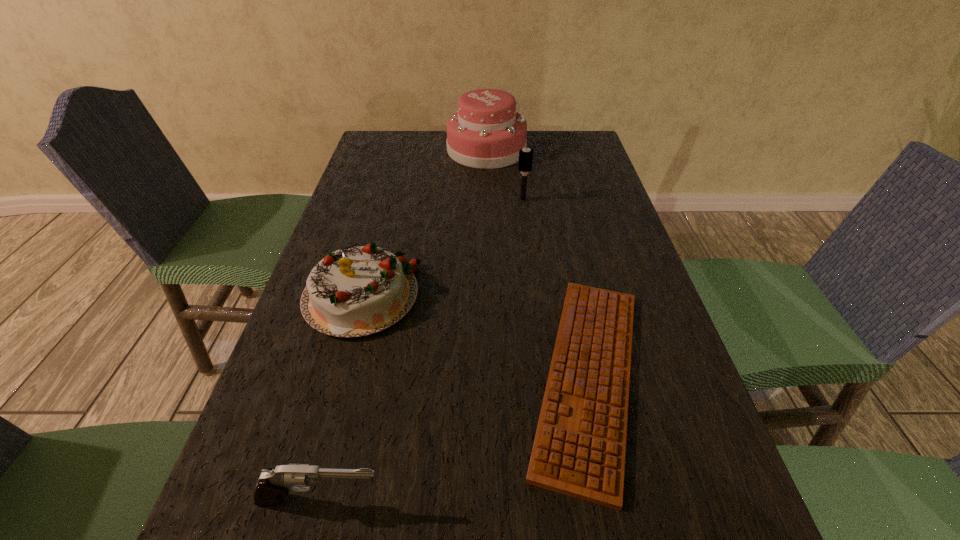
I want to click on the right cake, so click(486, 132).

Identify the location of the farther cake. (486, 132).

Where is `the second farthest object`? The image size is (960, 540). the second farthest object is located at coordinates (525, 157).

Identify the location of the left cake. The width and height of the screenshot is (960, 540). (356, 291).

I want to click on the shorter cake, so click(356, 291).

Locate an element on the screen. The height and width of the screenshot is (540, 960). the fourth tallest object is located at coordinates (272, 484).

The width and height of the screenshot is (960, 540). Find the location of `the shortest object`. the shortest object is located at coordinates (579, 449).

What are the coordinates of `blank area located 0.110m on the front of the right cake` in the screenshot? It's located at (488, 188).

Identify the location of vacant space located on the left of the hairbrush. This screenshot has height=540, width=960. (460, 200).

The width and height of the screenshot is (960, 540). Find the location of `blank space located on the front of the nearer cake`. blank space located on the front of the nearer cake is located at coordinates (307, 491).